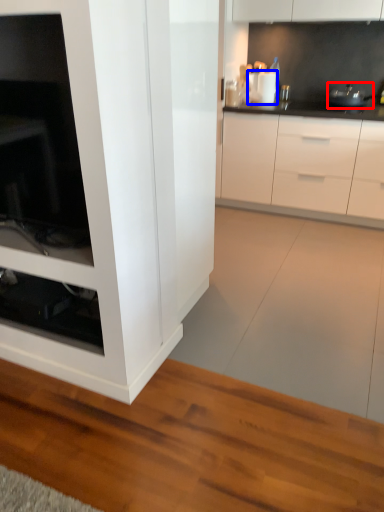
Question: Which point is closer to the camera, appliance (highlighted by a red box) or appliance (highlighted by a blue box)?

Choices:
 (A) appliance
 (B) appliance

Answer: (A)